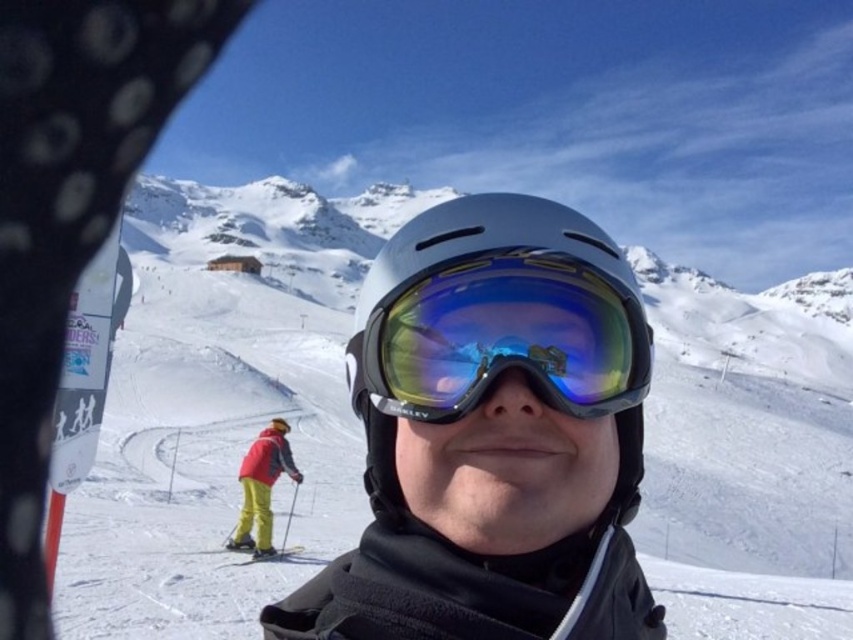
You are a photographer trying to capture a closeup shot of the matte gray helmet at center and the shiny reflective ski goggles at center. Given that your camera can focus on objects within a 3 feet range, will both items be in focus?

The distance between the matte gray helmet at center and the shiny reflective ski goggles at center is 3.47 feet, which exceeds the camera focus range of 3 feet. Therefore, both items cannot be in focus simultaneously.

In the scene shown: You are a photographer trying to capture the skier in the red jacket and yellow pants. You notice a point at coordinates point (495, 323). Where is this point located?

The point (495, 323) is located on the matte gray helmet at center.